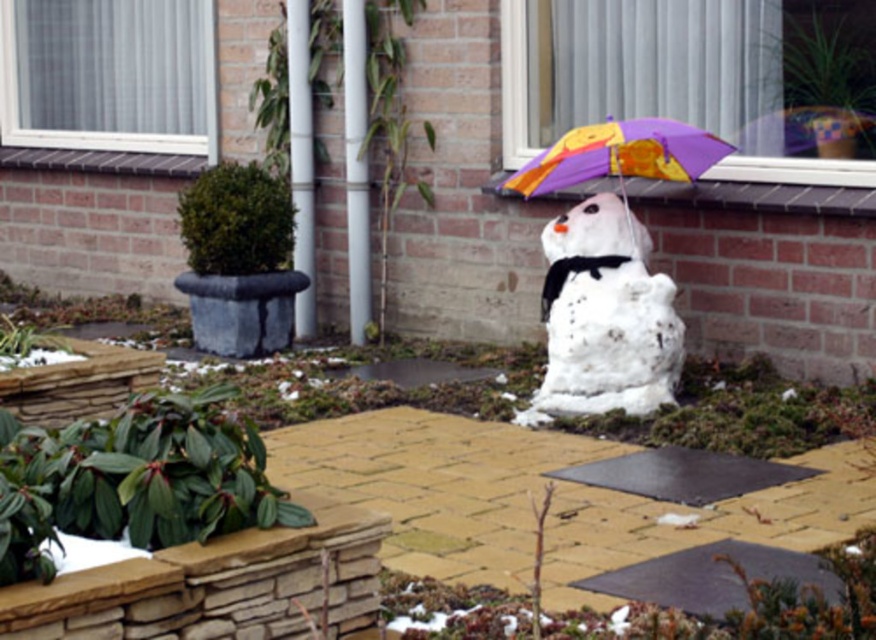
Which is behind, point (553, 186) or point (767, 141)?

Point (767, 141)

Between matte plastic umbrella at center and purple fabric umbrella at upper center, which one appears on the right side from the viewer's perspective?

From the viewer's perspective, purple fabric umbrella at upper center appears more on the right side.

In order to click on matte plastic umbrella at center in this screenshot , I will do `click(620, 157)`.

Where is `matte plastic umbrella at center`? matte plastic umbrella at center is located at coordinates (620, 157).

Does point (606, 352) come behind point (827, 147)?

No.

Between point (675, 316) and point (760, 131), which one is positioned behind?

The point (760, 131) is more distant.

Does point (653, 368) come behind point (760, 147)?

That is False.

At what (x,y) coordinates should I click in order to perform the action: click on white fluffy snowman at center. Please return your answer as a coordinate pair (x, y). This screenshot has height=640, width=876. Looking at the image, I should click on (604, 316).

Which is above, white fluffy snowman at center or matte plastic umbrella at center?

matte plastic umbrella at center is higher up.

Can you confirm if white fluffy snowman at center is wider than matte plastic umbrella at center?

In fact, white fluffy snowman at center might be narrower than matte plastic umbrella at center.

Where is `white fluffy snowman at center`? The width and height of the screenshot is (876, 640). white fluffy snowman at center is located at coordinates (604, 316).